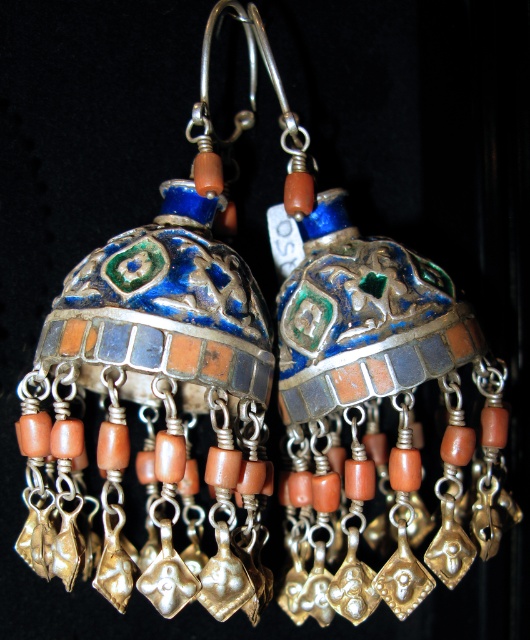
What is located at the coordinates point (x=152, y=390) in the image?

The point (x=152, y=390) is where the enamel and metallic earrings are located at center.